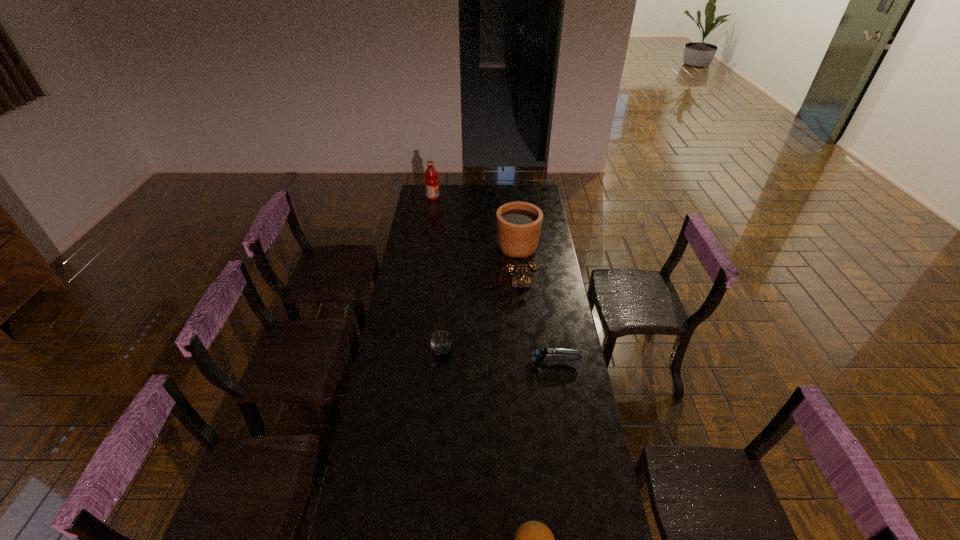
Locate an element on the screen. The image size is (960, 540). the farthest object is located at coordinates pyautogui.click(x=431, y=182).

This screenshot has width=960, height=540. Identify the location of fruit juice. (431, 182).

Find the location of a particular element. the second farthest object is located at coordinates (518, 223).

This screenshot has width=960, height=540. I want to click on the fourth shortest object, so click(521, 280).

The image size is (960, 540). What are the coordinates of `telephone` in the screenshot? It's located at (521, 280).

Locate an element on the screen. the fifth object from right to left is located at coordinates coord(441,341).

Find the location of `telephoto lens`. telephoto lens is located at coordinates (441, 341).

The width and height of the screenshot is (960, 540). In order to click on electric shaver in this screenshot , I will do `click(540, 356)`.

This screenshot has height=540, width=960. I want to click on free space located on the front label of the farthest object, so click(x=485, y=198).

Locate an element on the screen. blank space located on the left of the second farthest object is located at coordinates (428, 247).